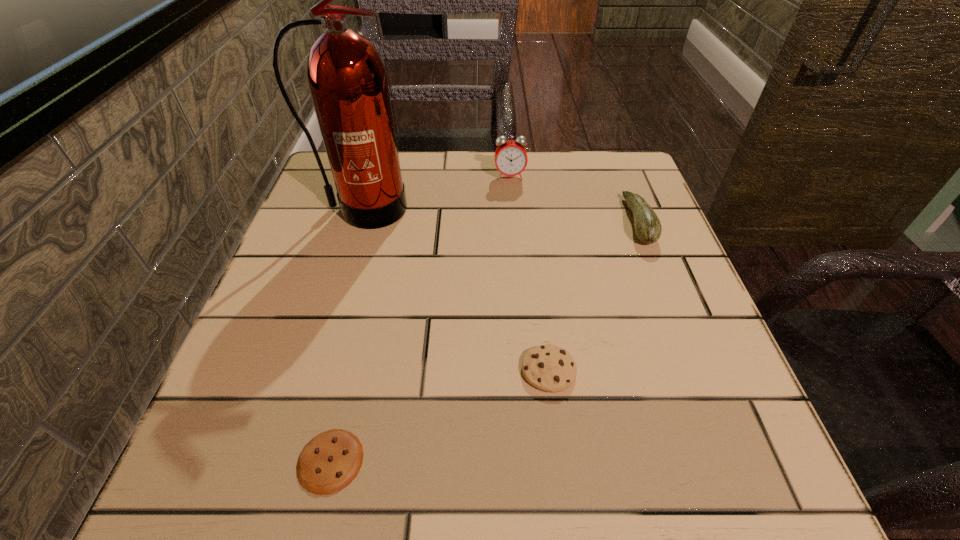
Identify the location of free location at the far right corner. (624, 199).

This screenshot has height=540, width=960. In order to click on blank space at the near right corner of the desktop in this screenshot , I will do `click(760, 447)`.

Where is `vacant area between the third shortest object and the tallest object`? This screenshot has width=960, height=540. vacant area between the third shortest object and the tallest object is located at coordinates (500, 215).

The image size is (960, 540). Find the location of `vacant area that lies between the taller cookie and the zucchini`. vacant area that lies between the taller cookie and the zucchini is located at coordinates (593, 296).

You are a GUI agent. You are given a task and a screenshot of the screen. Output one action in this format:
    pyautogui.click(x=<x>, y=<y>)
    Task: Click on the free space between the farther cookie and the fourth shortest object
    The width and height of the screenshot is (960, 540).
    Given the screenshot: What is the action you would take?
    pyautogui.click(x=529, y=273)

Where is `free space between the fourth farthest object and the shorter cookie`? The image size is (960, 540). free space between the fourth farthest object and the shorter cookie is located at coordinates (440, 416).

This screenshot has height=540, width=960. I want to click on unoccupied position between the fourth tallest object and the second tallest object, so click(x=529, y=273).

Identify the location of vacant area that lies between the second shortest object and the zucchini. The image size is (960, 540). (593, 296).

Locate an element on the screen. The height and width of the screenshot is (540, 960). vacant point located between the farther cookie and the third shortest object is located at coordinates (593, 296).

Find the location of a particular element. This screenshot has height=540, width=960. vacant area that lies between the farthest object and the shorter cookie is located at coordinates (420, 319).